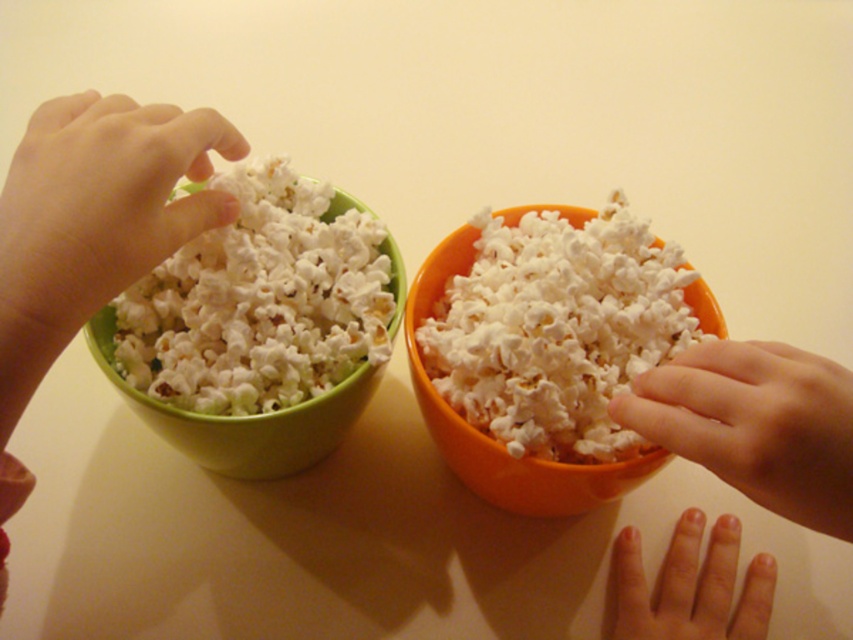
Where is the matte white hand at left located in the image?

The matte white hand at left is located at point (99, 208).

From the picture: You are trying to place a small decorative item on the table between the smooth green bowl at left and another bowl. According to the coordinates provided, where should you place the item to ensure it is centered between them?

The smooth green bowl at left is located at point (91, 228). To center the item between the bowls, you would need the coordinates of both bowls. Since only the green bowl has coordinates provided, the exact midpoint cannot be determined without the orange bowl

You are trying to grab a handful of popcorn from the smooth green bowl at left and the smooth skin hand at center. Which object is closer to your hand?

The smooth green bowl at left is closer to the viewer than the smooth skin hand at center, so the smooth green bowl at left is closer to your hand.